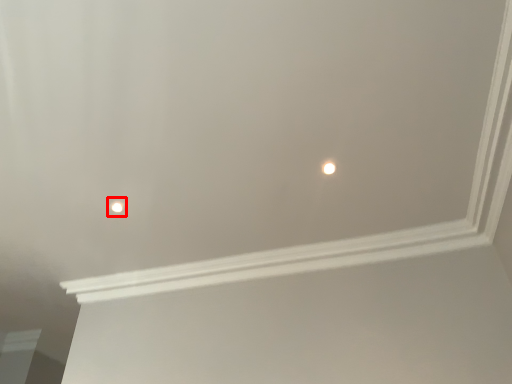
Question: Considering the relative positions of light (annotated by the red box) and light in the image provided, where is light (annotated by the red box) located with respect to the staircase?

Choices:
 (A) right
 (B) left

Answer: (B)